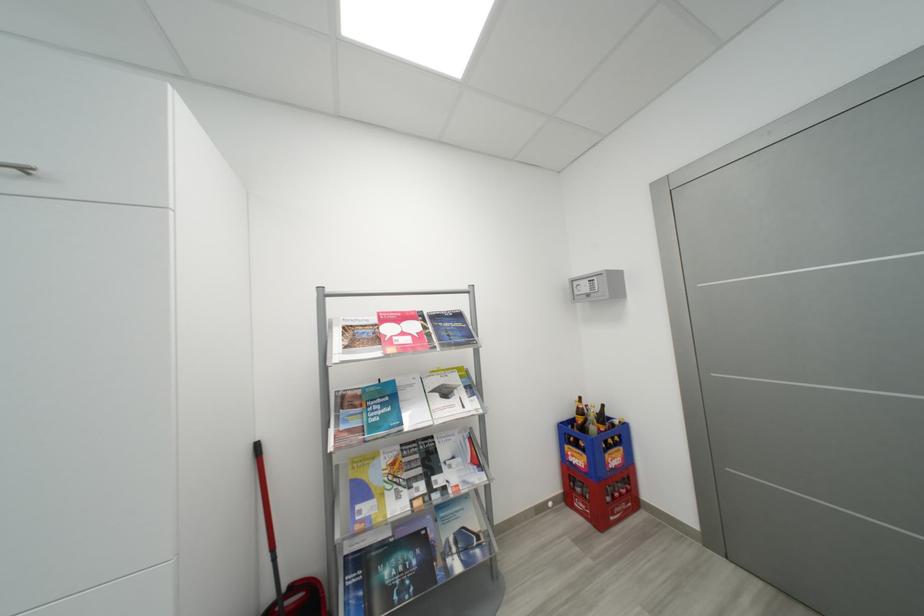
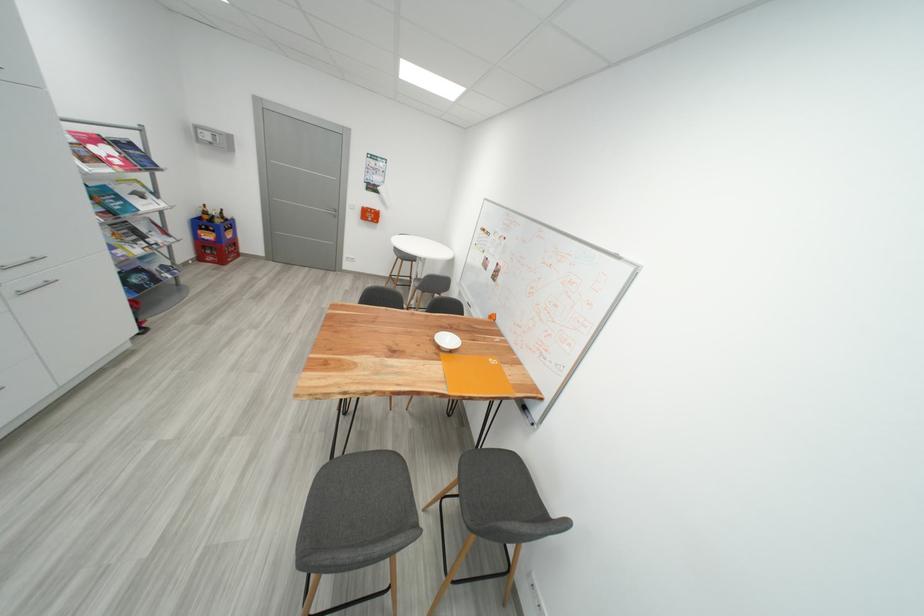
The point at (600, 430) is marked in the first image. Where is the corresponding point in the second image?

(225, 223)